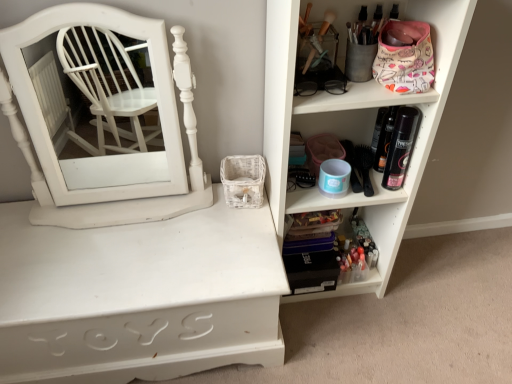
The width and height of the screenshot is (512, 384). Identify the location of free spot to the right of white plastic shelf at upper right, the first shelf positioned from the right. (423, 287).